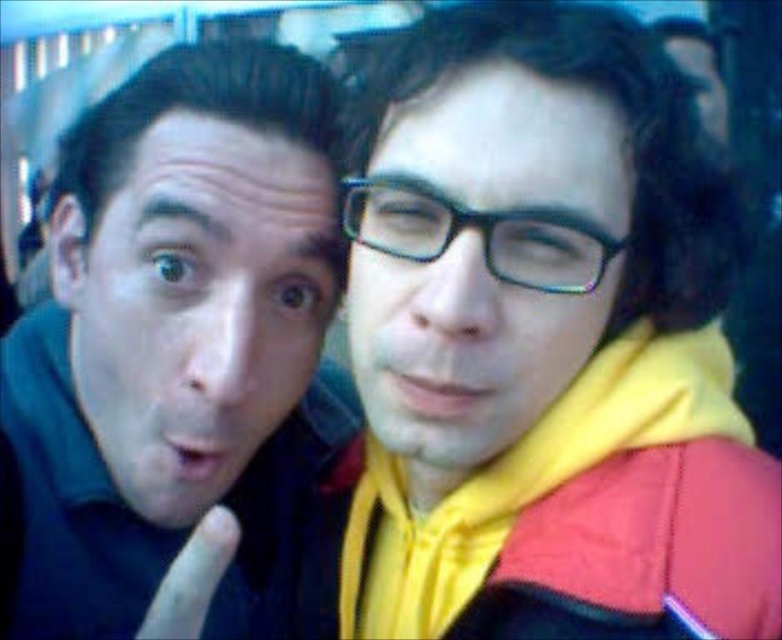
Where is `matte black shirt at left`? Image resolution: width=782 pixels, height=640 pixels. matte black shirt at left is located at coordinates (178, 348).

Which is behind, point (170, 131) or point (443, 212)?

Positioned behind is point (170, 131).

Which is behind, point (275, 532) or point (524, 218)?

Positioned behind is point (275, 532).

I want to click on matte black shirt at left, so click(x=178, y=348).